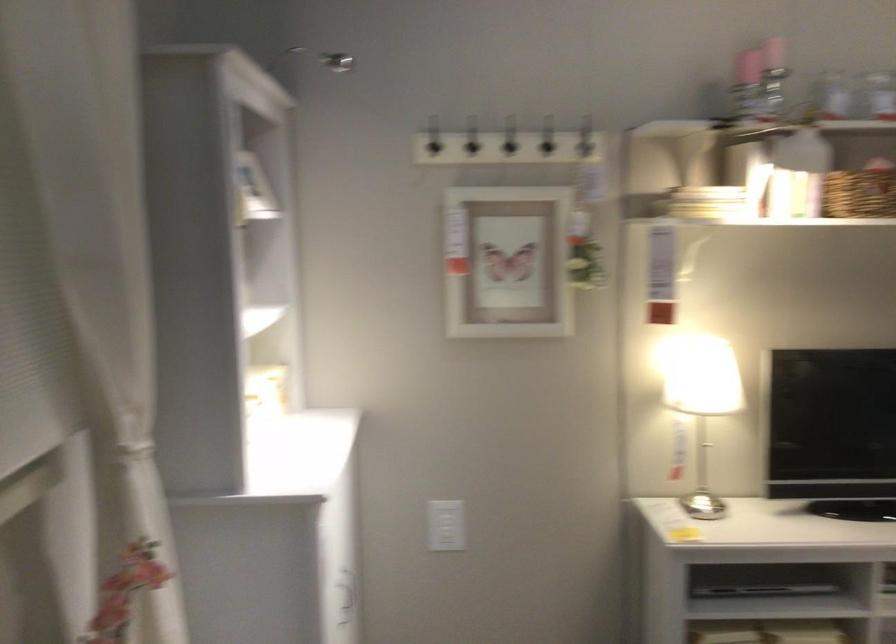
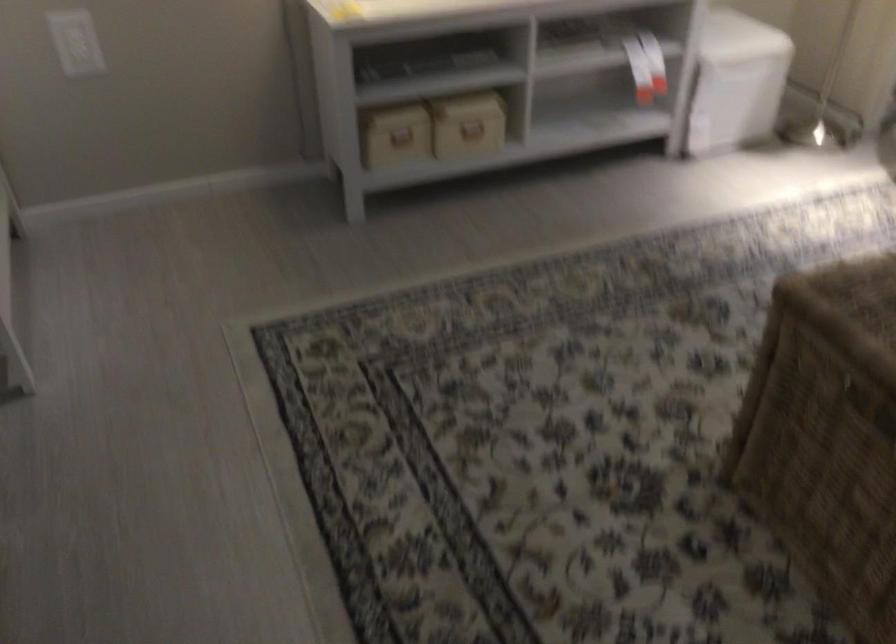
Find the pixel in the second image that matches [446,520] in the first image.

(75, 42)